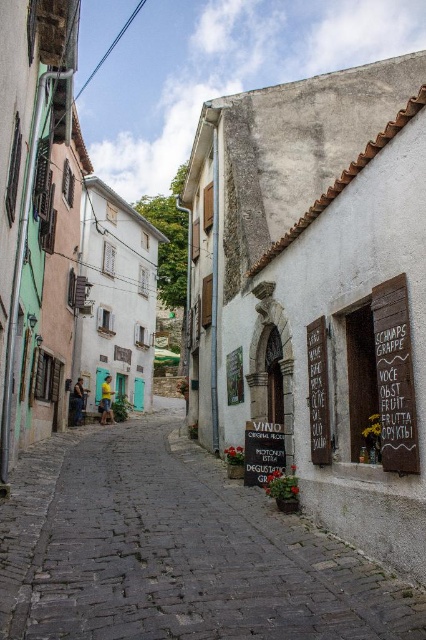
Can you confirm if brick cobblestone street at center is shorter than black matte sign at center?

Indeed, brick cobblestone street at center has a lesser height compared to black matte sign at center.

Is brick cobblestone street at center taller than black matte sign at center?

No, brick cobblestone street at center is not taller than black matte sign at center.

Who is more forward, (34, 570) or (271, 456)?

Positioned in front is point (34, 570).

You are a GUI agent. You are given a task and a screenshot of the screen. Output one action in this format:
    pyautogui.click(x=<x>, y=<y>)
    Task: Click on the brick cobblestone street at center
    This screenshot has height=640, width=426.
    Given the screenshot: What is the action you would take?
    pyautogui.click(x=175, y=548)

Looking at this image, can you confirm if brick cobblestone street at center is bigger than brown wooden signboard at right?

Yes.

Is brick cobblestone street at center below brown wooden signboard at right?

Correct, brick cobblestone street at center is located below brown wooden signboard at right.

Which is behind, point (25, 552) or point (397, 276)?

The point (397, 276) is more distant.

I want to click on brick cobblestone street at center, so click(175, 548).

Between black wood sign at right and black matte sign at center, which one has less height?

With less height is black wood sign at right.

Is point (310, 460) positioned in front of point (275, 428)?

Yes.

At what (x,y) coordinates should I click in order to perform the action: click on black wood sign at right. Please return your answer as a coordinate pair (x, y). Looking at the image, I should click on (317, 392).